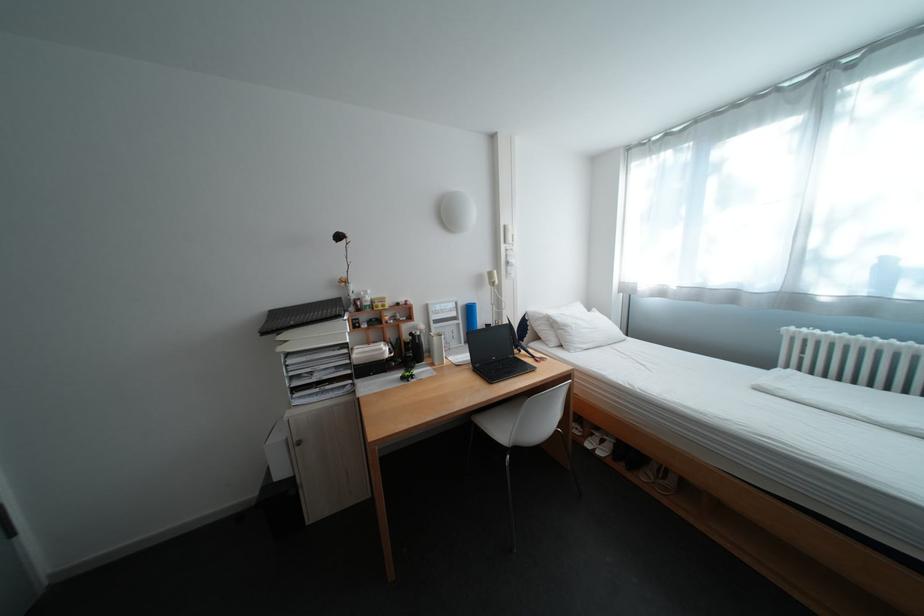
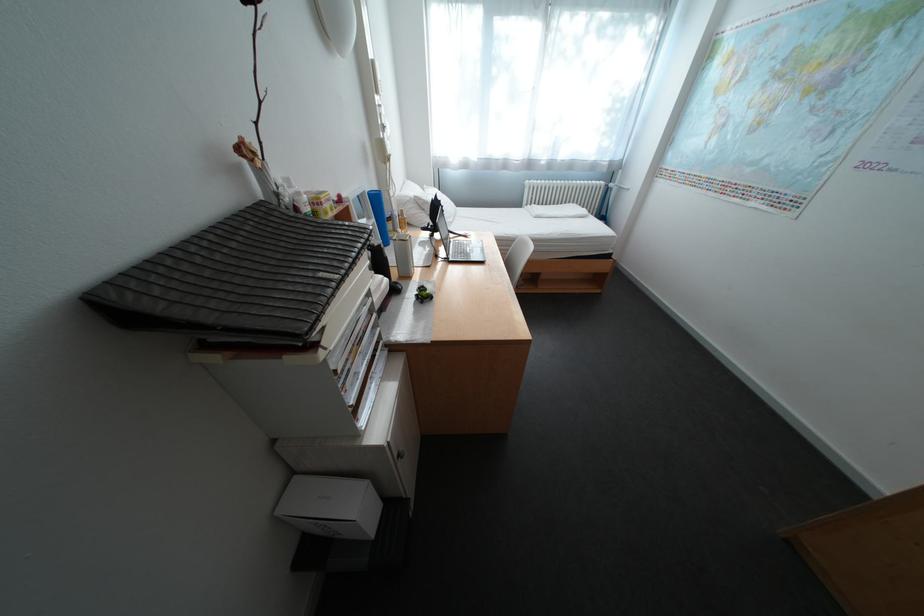
Locate, in the second image, the point that corresponds to the point at 545,358 in the first image.

(472, 236)